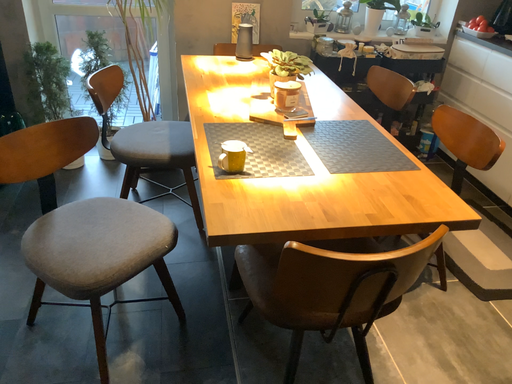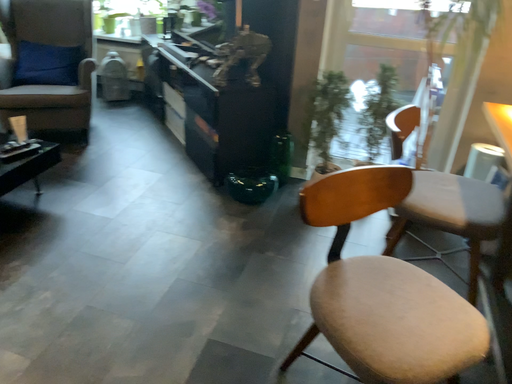
Question: Which way did the camera rotate in the video?

Choices:
 (A) rotated left
 (B) rotated right

Answer: (A)